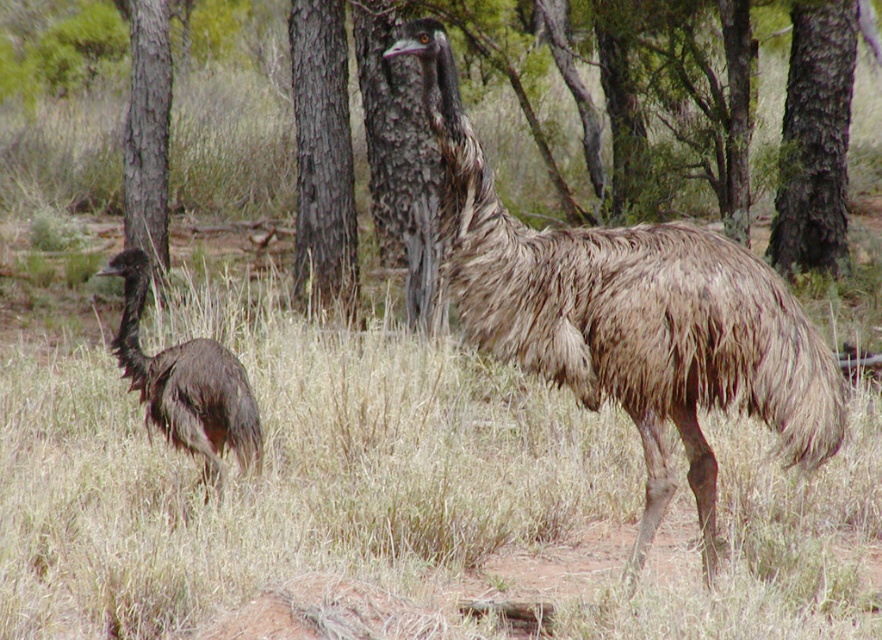
Question: Does brown rough bark tree at upper right appear on the left side of brown rough bark tree at center?

Choices:
 (A) yes
 (B) no

Answer: (B)

Question: Estimate the real-world distances between objects in this image. Which object is farther from the brown rough bark tree at center?

Choices:
 (A) brown textured grass at center
 (B) brown feathered ostrich at left
 (C) brown rough tree at left
 (D) brown textured ostrich at center

Answer: (D)

Question: Which of the following is the closest to the observer?

Choices:
 (A) brown rough bark tree at upper right
 (B) brown textured grass at center

Answer: (B)

Question: Which is farther from the brown textured ostrich at center?

Choices:
 (A) brown rough bark tree at upper right
 (B) brown textured grass at center

Answer: (A)

Question: Is brown textured grass at center smaller than brown textured ostrich at center?

Choices:
 (A) yes
 (B) no

Answer: (B)

Question: Is the position of brown textured grass at center less distant than that of brown feathered ostrich at left?

Choices:
 (A) no
 (B) yes

Answer: (A)